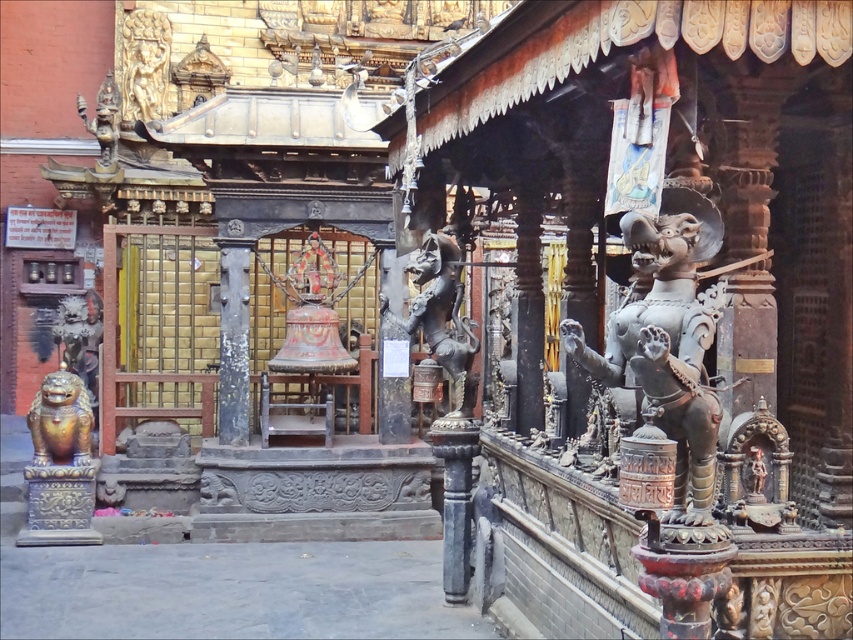
Question: Which object appears farthest from the camera in this image?

Choices:
 (A) gold polished lion at lower left
 (B) polished bronze statue at center
 (C) golden stone statue at upper left

Answer: (C)

Question: Which point is closer to the camera?

Choices:
 (A) polished bronze statue at right
 (B) golden stone statue at upper left
 (C) polished bronze statue at center
 (D) gold polished lion at lower left

Answer: (A)

Question: Is polished bronze statue at center wider than gold polished lion at lower left?

Choices:
 (A) yes
 (B) no

Answer: (B)

Question: Which is nearer to the gold polished lion at lower left?

Choices:
 (A) golden stone statue at upper left
 (B) polished bronze statue at center

Answer: (B)

Question: Considering the relative positions of gold polished lion at lower left and golden stone statue at upper left in the image provided, where is gold polished lion at lower left located with respect to golden stone statue at upper left?

Choices:
 (A) left
 (B) right

Answer: (B)

Question: Can you confirm if polished bronze statue at right is thinner than gold polished lion at lower left?

Choices:
 (A) no
 (B) yes

Answer: (A)